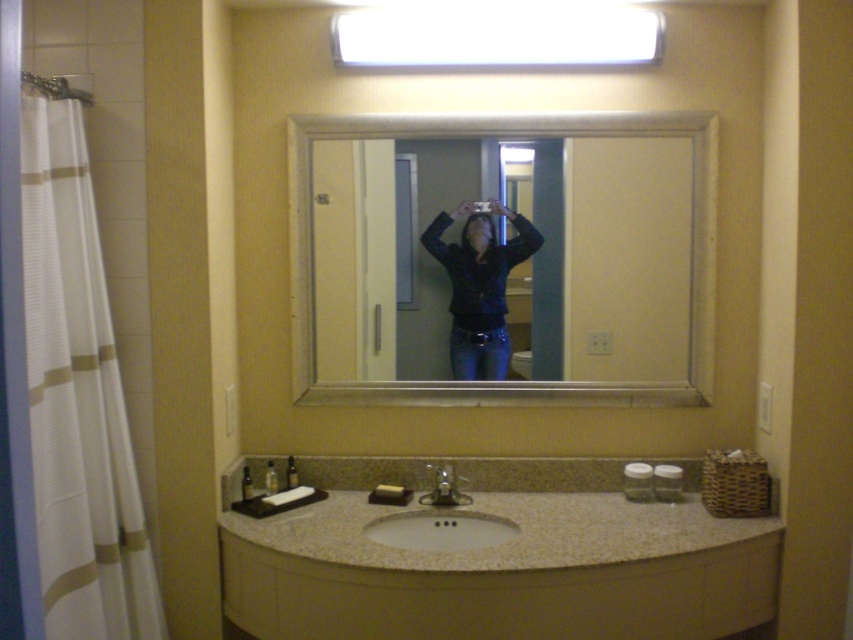
Question: Does white glossy sink at center appear on the right side of brushed metal shower at upper left?

Choices:
 (A) yes
 (B) no

Answer: (A)

Question: Which object is farther from the camera taking this photo?

Choices:
 (A) brushed metal shower at upper left
 (B) white textured fabric at left
 (C) white glossy sink at center

Answer: (C)

Question: Among these objects, which one is nearest to the camera?

Choices:
 (A) white glossy sink at center
 (B) white textured fabric at left
 (C) silver metallic mirror at center
 (D) brushed metal shower at upper left

Answer: (B)

Question: Can you confirm if silver metallic faucet at center is bigger than brushed metal shower at upper left?

Choices:
 (A) no
 (B) yes

Answer: (A)

Question: Which point is closer to the camera?

Choices:
 (A) silver metallic faucet at center
 (B) shiny black jacket at center
 (C) white glossy sink at center

Answer: (C)

Question: Does white glossy sink at center appear on the left side of brushed metal shower at upper left?

Choices:
 (A) no
 (B) yes

Answer: (A)